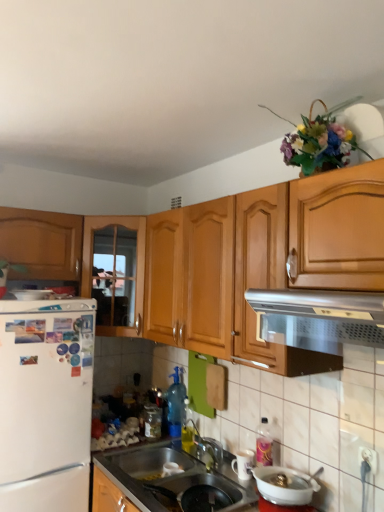
You are a GUI agent. You are given a task and a screenshot of the screen. Output one action in this format:
    pyautogui.click(x=<x>, y=<y>)
    Task: Click on the white matte refrigerator at left
    This screenshot has height=512, width=384.
    Given the screenshot: What is the action you would take?
    pyautogui.click(x=46, y=404)

This screenshot has height=512, width=384. What do you see at coordinates (319, 318) in the screenshot?
I see `silver metallic vent at upper center` at bounding box center [319, 318].

You are a GUI agent. You are given a task and a screenshot of the screen. Output one action in this format:
    pyautogui.click(x=<x>, y=<y>)
    Task: Click on the transparent plastic spray bottle at center, the first bottle viewed from the right
    This screenshot has width=384, height=512.
    Given the screenshot: What is the action you would take?
    (176, 402)

How much space does transparent plastic spray bottle at center, which is counted as the 2th bottle, starting from the left, occupy horizontally?

transparent plastic spray bottle at center, which is counted as the 2th bottle, starting from the left, is 4.26 inches wide.

Describe the element at coordinates (115, 269) in the screenshot. The width and height of the screenshot is (384, 512). I see `wooden cabinet at left, placed as the second cabinetry when sorted from left to right` at that location.

Identify the location of metallic stainless steel sink at lower center. The image size is (384, 512). (166, 481).

What is the approximate width of white glossy mug at lower center, acting as the 2th appliance starting from the left?

5.20 inches.

Where is `white glossy refrigerator at left, which is the 3th appliance from right to left`? Image resolution: width=384 pixels, height=512 pixels. white glossy refrigerator at left, which is the 3th appliance from right to left is located at coordinates (32, 294).

Which object is closer to the camera, transparent plastic spray bottle at center, which is counted as the 2th bottle, starting from the left, or white glossy mug at lower center, the third appliance when ordered from top to bottom?

white glossy mug at lower center, the third appliance when ordered from top to bottom.

Could white glossy mug at lower center, marked as the 2th appliance in a right-to-left arrangement, be considered to be inside transparent plastic spray bottle at center, the first bottle viewed from the right?

No.

Is transparent plastic spray bottle at center, which is counted as the 2th bottle, starting from the left, wider than white glossy mug at lower center, the third appliance when ordered from top to bottom?

No, transparent plastic spray bottle at center, which is counted as the 2th bottle, starting from the left, is not wider than white glossy mug at lower center, the third appliance when ordered from top to bottom.

Between transparent plastic spray bottle at center, which is counted as the 2th bottle, starting from the left, and white glossy mug at lower center, placed as the 1th appliance when sorted from bottom to top, which one has larger size?

With larger size is transparent plastic spray bottle at center, which is counted as the 2th bottle, starting from the left.

Based on the photo, how far apart are metallic stainless steel sink at lower center and wooden cabinet at left, which is the 2th cabinetry from right to left?

A distance of 1.19 meters exists between metallic stainless steel sink at lower center and wooden cabinet at left, which is the 2th cabinetry from right to left.

Based on the photo, is metallic stainless steel sink at lower center looking in the opposite direction of wooden cabinet at left, which is the 2th cabinetry from right to left?

That's not correct — metallic stainless steel sink at lower center is not looking away from wooden cabinet at left, which is the 2th cabinetry from right to left.

In terms of height, does metallic stainless steel sink at lower center look taller or shorter compared to wooden cabinet at left, which ranks as the first cabinetry in left-to-right order?

Considering their sizes, metallic stainless steel sink at lower center has less height than wooden cabinet at left, which ranks as the first cabinetry in left-to-right order.

From a real-world perspective, is metallic stainless steel sink at lower center physically located above or below wooden cabinet at left, which ranks as the first cabinetry in left-to-right order?

metallic stainless steel sink at lower center is situated lower than wooden cabinet at left, which ranks as the first cabinetry in left-to-right order, in the real world.

Is wooden cabinet at left, which is the 2th cabinetry from right to left, looking in the opposite direction of white glossy refrigerator at left, the first appliance viewed from the left?

wooden cabinet at left, which is the 2th cabinetry from right to left, does not have its back to white glossy refrigerator at left, the first appliance viewed from the left.

Is wooden cabinet at left, which ranks as the first cabinetry in left-to-right order, shorter than white glossy refrigerator at left, the first appliance viewed from the left?

Incorrect, the height of wooden cabinet at left, which ranks as the first cabinetry in left-to-right order, does not fall short of that of white glossy refrigerator at left, the first appliance viewed from the left.

From the picture: How different are the orientations of wooden cabinet at left, which is the 2th cabinetry from right to left, and white glossy refrigerator at left, which is counted as the first appliance, starting from the back, in degrees?

wooden cabinet at left, which is the 2th cabinetry from right to left, and white glossy refrigerator at left, which is counted as the first appliance, starting from the back, are facing 0.00324 degrees away from each other.

Is wooden cabinet at left, which is the 2th cabinetry from right to left, wider than white glossy refrigerator at left, the first appliance viewed from the left?

Correct, the width of wooden cabinet at left, which is the 2th cabinetry from right to left, exceeds that of white glossy refrigerator at left, the first appliance viewed from the left.

Could you tell me if transparent plastic spray bottle at center, which is counted as the 2th bottle, starting from the left, is turned towards wooden cabinet at left, positioned as the first cabinetry in right-to-left order?

No, transparent plastic spray bottle at center, which is counted as the 2th bottle, starting from the left, is not oriented towards wooden cabinet at left, positioned as the first cabinetry in right-to-left order.

The height and width of the screenshot is (512, 384). I want to click on the 1st cabinetry to the left of the transparent plastic spray bottle at center, which is counted as the 2th bottle, starting from the left, counting from the anchor's position, so click(x=115, y=269).

Considering the sizes of objects transparent plastic spray bottle at center, which is counted as the 2th bottle, starting from the left, and wooden cabinet at left, placed as the second cabinetry when sorted from left to right, in the image provided, who is bigger, transparent plastic spray bottle at center, which is counted as the 2th bottle, starting from the left, or wooden cabinet at left, placed as the second cabinetry when sorted from left to right,?

Bigger between the two is wooden cabinet at left, placed as the second cabinetry when sorted from left to right.

Between transparent plastic spray bottle at center, which is counted as the 2th bottle, starting from the left, and white matte refrigerator at left, which one has smaller size?

With smaller size is transparent plastic spray bottle at center, which is counted as the 2th bottle, starting from the left.

From the picture: Considering the sizes of objects transparent plastic spray bottle at center, the first bottle viewed from the right, and white matte refrigerator at left in the image provided, who is wider, transparent plastic spray bottle at center, the first bottle viewed from the right, or white matte refrigerator at left?

With larger width is white matte refrigerator at left.

Is transparent plastic spray bottle at center, the first bottle viewed from the right, located outside white matte refrigerator at left?

Absolutely, transparent plastic spray bottle at center, the first bottle viewed from the right, is external to white matte refrigerator at left.

Can you confirm if transparent plastic spray bottle at center, which is counted as the 2th bottle, starting from the left, is positioned to the right of white matte refrigerator at left?

Correct, you'll find transparent plastic spray bottle at center, which is counted as the 2th bottle, starting from the left, to the right of white matte refrigerator at left.

Is transparent glass jar at sink, which appears as the first bottle when viewed from the left, oriented away from wooden cabinet at left, placed as the second cabinetry when sorted from left to right?

No, transparent glass jar at sink, which appears as the first bottle when viewed from the left, is not facing away from wooden cabinet at left, placed as the second cabinetry when sorted from left to right.

Who is taller, transparent glass jar at sink, which is the second bottle in right-to-left order, or wooden cabinet at left, placed as the second cabinetry when sorted from left to right?

wooden cabinet at left, placed as the second cabinetry when sorted from left to right, is taller.

From a real-world perspective, relative to wooden cabinet at left, placed as the second cabinetry when sorted from left to right, is transparent glass jar at sink, which appears as the first bottle when viewed from the left, vertically above or below?

From a real-world perspective, transparent glass jar at sink, which appears as the first bottle when viewed from the left, is physically below wooden cabinet at left, placed as the second cabinetry when sorted from left to right.

Which object is further away from the camera, transparent glass jar at sink, which is the second bottle in right-to-left order, or wooden cabinet at left, positioned as the first cabinetry in right-to-left order?

transparent glass jar at sink, which is the second bottle in right-to-left order, is behind.

The height and width of the screenshot is (512, 384). Identify the location of the 1st appliance in front of the wooden cabinet at left, which ranks as the first cabinetry in left-to-right order, counting from the anchor's position. (32, 294).

Between white glossy refrigerator at left, which is the 3th appliance from right to left, and wooden cabinet at left, which ranks as the first cabinetry in left-to-right order, which one has less height?

Standing shorter between the two is white glossy refrigerator at left, which is the 3th appliance from right to left.

Is white glossy refrigerator at left, which is the first appliance in top-to-bottom order, positioned with its back to wooden cabinet at left, which is the 2th cabinetry from right to left?

No, white glossy refrigerator at left, which is the first appliance in top-to-bottom order, is not facing away from wooden cabinet at left, which is the 2th cabinetry from right to left.

From the image's perspective, which appliance is the 2nd one below the transparent plastic spray bottle at center, which is counted as the 2th bottle, starting from the left? Please provide its 2D coordinates.

[(243, 464)]

From a real-world perspective, which cabinetry is the 2nd one above the metallic stainless steel sink at lower center? Please provide its 2D coordinates.

[(42, 243)]

Based on their spatial positions, is metallic stainless steel sink at lower center or white glossy refrigerator at left, the first appliance viewed from the left, further from transparent plastic spray bottle at center, which is counted as the 2th bottle, starting from the left?

Based on the image, white glossy refrigerator at left, the first appliance viewed from the left, appears to be further to transparent plastic spray bottle at center, which is counted as the 2th bottle, starting from the left.

Considering their positions, is white glossy mug at lower center, marked as the 2th appliance in a right-to-left arrangement, positioned further to wooden cabinet at left, which ranks as the first cabinetry in left-to-right order, than transparent glass jar at sink, which is the second bottle in right-to-left order?

white glossy mug at lower center, marked as the 2th appliance in a right-to-left arrangement, is positioned further to the anchor wooden cabinet at left, which ranks as the first cabinetry in left-to-right order.

Based on their spatial positions, is white matte refrigerator at left or metallic stainless steel sink at lower center further from white glossy refrigerator at left, which is the third appliance in front-to-back order?

metallic stainless steel sink at lower center lies further to white glossy refrigerator at left, which is the third appliance in front-to-back order, than the other object.

Based on the photo, looking at the image, which one is located closer to transparent glass jar at sink, which is the second bottle in right-to-left order, white glossy refrigerator at left, which is the 3th appliance from right to left, or white glossy mug at lower center, placed as the 2th appliance when sorted from back to front?

white glossy mug at lower center, placed as the 2th appliance when sorted from back to front, is closer to transparent glass jar at sink, which is the second bottle in right-to-left order.

Estimate the real-world distances between objects in this image. Which object is closer to transparent glass jar at sink, which is the second bottle in right-to-left order, white glossy mug at lower center, placed as the 2th appliance when sorted from back to front, or white glossy bowl at lower center, arranged as the third appliance when viewed from the back?

white glossy mug at lower center, placed as the 2th appliance when sorted from back to front, is positioned closer to the anchor transparent glass jar at sink, which is the second bottle in right-to-left order.

Estimate the real-world distances between objects in this image. Which object is closer to transparent glass jar at sink, which appears as the first bottle when viewed from the left, wooden cabinet at left, placed as the second cabinetry when sorted from left to right, or white glossy refrigerator at left, arranged as the third appliance when ordered from the bottom?

wooden cabinet at left, placed as the second cabinetry when sorted from left to right.

Based on their spatial positions, is white matte refrigerator at left or wooden cabinet at left, which is the 2th cabinetry from right to left, closer to metallic stainless steel sink at lower center?

Among the two, white matte refrigerator at left is located nearer to metallic stainless steel sink at lower center.

When comparing their distances from silver metallic vent at upper center, does metallic stainless steel sink at lower center or transparent glass jar at sink, which is the second bottle in right-to-left order, seem closer?

Based on the image, metallic stainless steel sink at lower center appears to be nearer to silver metallic vent at upper center.

Find the location of a particular element. refrigerator between wooden cabinet at left, positioned as the first cabinetry in right-to-left order, and metallic stainless steel sink at lower center vertically is located at coordinates (46, 404).

Image resolution: width=384 pixels, height=512 pixels. Identify the location of cabinetry between silver metallic vent at upper center and wooden cabinet at left, placed as the second cabinetry when sorted from left to right, from front to back. (42, 243).

This screenshot has width=384, height=512. I want to click on countertop located between white matte refrigerator at left and silver metallic vent at upper center in the left-right direction, so click(x=166, y=481).

This screenshot has height=512, width=384. Identify the location of refrigerator between metallic stainless steel sink at lower center and transparent plastic spray bottle at center, which is counted as the 2th bottle, starting from the left, in the front-back direction. (46, 404).